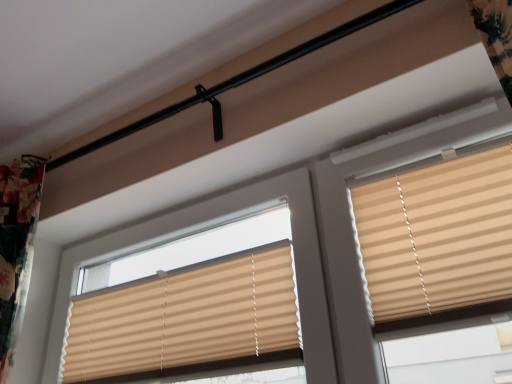
Describe the element at coordinates (437, 236) in the screenshot. I see `beige pleated blinds at upper right, acting as the first window blind starting from the right` at that location.

Where is `beige pleated blinds at upper right, the second window blind from the left`? beige pleated blinds at upper right, the second window blind from the left is located at coordinates (437, 236).

Where is `beige pleated blind at center, placed as the 2th window blind when sorted from right to left`? This screenshot has width=512, height=384. beige pleated blind at center, placed as the 2th window blind when sorted from right to left is located at coordinates (186, 319).

Image resolution: width=512 pixels, height=384 pixels. What do you see at coordinates (186, 319) in the screenshot? I see `beige pleated blind at center, placed as the 2th window blind when sorted from right to left` at bounding box center [186, 319].

The height and width of the screenshot is (384, 512). Find the location of `beige pleated blinds at upper right, acting as the first window blind starting from the right`. beige pleated blinds at upper right, acting as the first window blind starting from the right is located at coordinates (437, 236).

Which object is positioned more to the left, beige pleated blind at center, marked as the 1th window blind in a left-to-right arrangement, or beige pleated blinds at upper right, the second window blind from the left?

Positioned to the left is beige pleated blind at center, marked as the 1th window blind in a left-to-right arrangement.

Which is in front, beige pleated blind at center, placed as the 2th window blind when sorted from right to left, or beige pleated blinds at upper right, acting as the first window blind starting from the right?

beige pleated blinds at upper right, acting as the first window blind starting from the right.

Does point (208, 337) come in front of point (445, 270)?

No, (208, 337) is behind (445, 270).

From the image's perspective, is beige pleated blind at center, marked as the 1th window blind in a left-to-right arrangement, under beige pleated blinds at upper right, the second window blind from the left?

Indeed, from the image's perspective, beige pleated blind at center, marked as the 1th window blind in a left-to-right arrangement, is shown beneath beige pleated blinds at upper right, the second window blind from the left.

From a real-world perspective, who is located lower, beige pleated blind at center, placed as the 2th window blind when sorted from right to left, or beige pleated blinds at upper right, the second window blind from the left?

beige pleated blind at center, placed as the 2th window blind when sorted from right to left.

Can you confirm if beige pleated blind at center, placed as the 2th window blind when sorted from right to left, is thinner than beige pleated blinds at upper right, acting as the first window blind starting from the right?

Yes.

Is beige pleated blind at center, placed as the 2th window blind when sorted from right to left, shorter than beige pleated blinds at upper right, acting as the first window blind starting from the right?

Yes, beige pleated blind at center, placed as the 2th window blind when sorted from right to left, is shorter than beige pleated blinds at upper right, acting as the first window blind starting from the right.

Which of these two, beige pleated blind at center, placed as the 2th window blind when sorted from right to left, or beige pleated blinds at upper right, the second window blind from the left, is smaller?

With smaller size is beige pleated blinds at upper right, the second window blind from the left.

Which is correct: beige pleated blind at center, placed as the 2th window blind when sorted from right to left, is inside beige pleated blinds at upper right, acting as the first window blind starting from the right, or outside of it?

beige pleated blind at center, placed as the 2th window blind when sorted from right to left, is spatially situated outside beige pleated blinds at upper right, acting as the first window blind starting from the right.

Is there a large distance between beige pleated blind at center, marked as the 1th window blind in a left-to-right arrangement, and beige pleated blinds at upper right, the second window blind from the left?

beige pleated blind at center, marked as the 1th window blind in a left-to-right arrangement, is actually quite close to beige pleated blinds at upper right, the second window blind from the left.

Is beige pleated blind at center, marked as the 1th window blind in a left-to-right arrangement, looking in the opposite direction of beige pleated blinds at upper right, acting as the first window blind starting from the right?

No, beige pleated blind at center, marked as the 1th window blind in a left-to-right arrangement, is not facing away from beige pleated blinds at upper right, acting as the first window blind starting from the right.

How many degrees apart are the facing directions of beige pleated blind at center, placed as the 2th window blind when sorted from right to left, and beige pleated blinds at upper right, the second window blind from the left?

The angle between the facing direction of beige pleated blind at center, placed as the 2th window blind when sorted from right to left, and the facing direction of beige pleated blinds at upper right, the second window blind from the left, is 5.61e-05 degrees.

The width and height of the screenshot is (512, 384). What are the coordinates of `window blind above the beige pleated blind at center, placed as the 2th window blind when sorted from right to left (from a real-world perspective)` in the screenshot? It's located at (437, 236).

Can you confirm if beige pleated blinds at upper right, acting as the first window blind starting from the right, is positioned to the left of beige pleated blind at center, placed as the 2th window blind when sorted from right to left?

In fact, beige pleated blinds at upper right, acting as the first window blind starting from the right, is to the right of beige pleated blind at center, placed as the 2th window blind when sorted from right to left.

Between beige pleated blinds at upper right, acting as the first window blind starting from the right, and beige pleated blind at center, placed as the 2th window blind when sorted from right to left, which one is positioned in front?

Positioned in front is beige pleated blinds at upper right, acting as the first window blind starting from the right.

Which point is more forward, (x=496, y=206) or (x=190, y=293)?

Positioned in front is point (x=496, y=206).

From the image's perspective, is beige pleated blinds at upper right, the second window blind from the left, under beige pleated blind at center, placed as the 2th window blind when sorted from right to left?

No, from the image's perspective, beige pleated blinds at upper right, the second window blind from the left, is not beneath beige pleated blind at center, placed as the 2th window blind when sorted from right to left.

From a real-world perspective, which is physically above, beige pleated blinds at upper right, the second window blind from the left, or beige pleated blind at center, placed as the 2th window blind when sorted from right to left?

From a 3D spatial view, beige pleated blinds at upper right, the second window blind from the left, is above.

Does beige pleated blinds at upper right, acting as the first window blind starting from the right, have a greater width compared to beige pleated blind at center, marked as the 1th window blind in a left-to-right arrangement?

Yes, beige pleated blinds at upper right, acting as the first window blind starting from the right, is wider than beige pleated blind at center, marked as the 1th window blind in a left-to-right arrangement.

Which of these two, beige pleated blinds at upper right, acting as the first window blind starting from the right, or beige pleated blind at center, marked as the 1th window blind in a left-to-right arrangement, stands taller?

beige pleated blinds at upper right, acting as the first window blind starting from the right, is taller.

Considering the sizes of objects beige pleated blinds at upper right, acting as the first window blind starting from the right, and beige pleated blind at center, placed as the 2th window blind when sorted from right to left, in the image provided, who is bigger, beige pleated blinds at upper right, acting as the first window blind starting from the right, or beige pleated blind at center, placed as the 2th window blind when sorted from right to left,?

Bigger between the two is beige pleated blind at center, placed as the 2th window blind when sorted from right to left.

Is beige pleated blinds at upper right, acting as the first window blind starting from the right, located outside beige pleated blind at center, placed as the 2th window blind when sorted from right to left?

Yes, beige pleated blinds at upper right, acting as the first window blind starting from the right, is not within beige pleated blind at center, placed as the 2th window blind when sorted from right to left.

Based on the photo, is beige pleated blinds at upper right, acting as the first window blind starting from the right, placed right next to beige pleated blind at center, marked as the 1th window blind in a left-to-right arrangement?

No, beige pleated blinds at upper right, acting as the first window blind starting from the right, is not making contact with beige pleated blind at center, marked as the 1th window blind in a left-to-right arrangement.

Is beige pleated blinds at upper right, acting as the first window blind starting from the right, oriented towards beige pleated blind at center, marked as the 1th window blind in a left-to-right arrangement?

No, beige pleated blinds at upper right, acting as the first window blind starting from the right, does not turn towards beige pleated blind at center, marked as the 1th window blind in a left-to-right arrangement.

How different are the orientations of beige pleated blinds at upper right, acting as the first window blind starting from the right, and beige pleated blind at center, marked as the 1th window blind in a left-to-right arrangement, in degrees?

The angular difference between beige pleated blinds at upper right, acting as the first window blind starting from the right, and beige pleated blind at center, marked as the 1th window blind in a left-to-right arrangement, is 5.61e-05 degrees.

The height and width of the screenshot is (384, 512). I want to click on window blind above the beige pleated blind at center, placed as the 2th window blind when sorted from right to left (from a real-world perspective), so click(x=437, y=236).

Where is `window blind that appears on the left of beige pleated blinds at upper right, the second window blind from the left`? This screenshot has height=384, width=512. window blind that appears on the left of beige pleated blinds at upper right, the second window blind from the left is located at coordinates (186, 319).

Where is `window blind below the beige pleated blinds at upper right, the second window blind from the left (from the image's perspective)`? This screenshot has width=512, height=384. window blind below the beige pleated blinds at upper right, the second window blind from the left (from the image's perspective) is located at coordinates (186, 319).